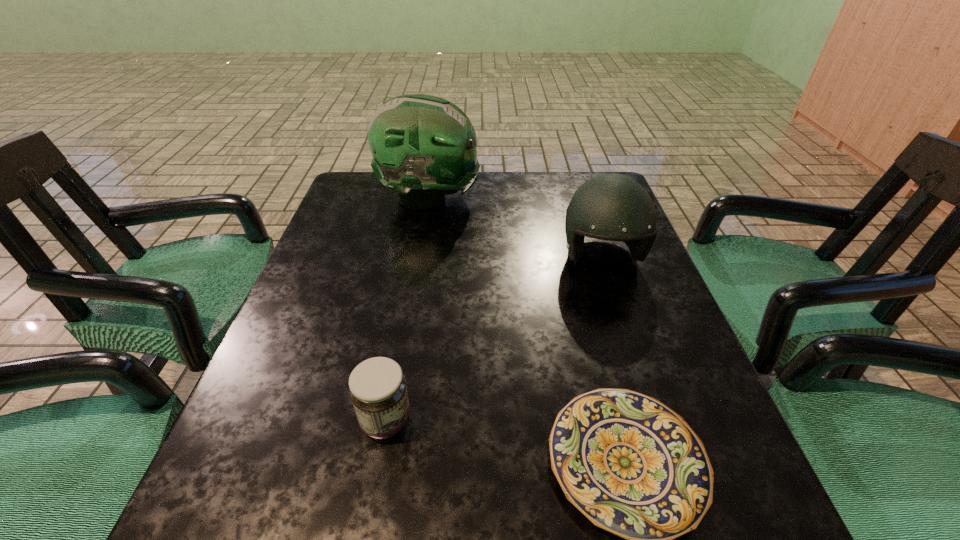
Identify the location of object located at the right edge. This screenshot has height=540, width=960. (614, 207).

You are a GUI agent. You are given a task and a screenshot of the screen. Output one action in this format:
    pyautogui.click(x=<x>, y=<y>)
    Task: Click on the object that is at the far left corner
    
    Given the screenshot: What is the action you would take?
    pyautogui.click(x=423, y=147)

Locate an element on the screen. vacant space at the near edge is located at coordinates (550, 501).

In the image, there is a desktop. In order to click on vacant region at the left edge in this screenshot , I will do `click(322, 236)`.

Locate an element on the screen. The image size is (960, 540). vacant space at the right edge is located at coordinates (585, 242).

Image resolution: width=960 pixels, height=540 pixels. In order to click on empty space between the jam and the third nearest object in this screenshot , I will do `click(493, 340)`.

The width and height of the screenshot is (960, 540). Find the location of `blank region between the taller football helmet and the third tallest object`. blank region between the taller football helmet and the third tallest object is located at coordinates (408, 309).

Locate an element on the screen. The width and height of the screenshot is (960, 540). free space between the shorter football helmet and the tallest object is located at coordinates (516, 228).

Identify the location of free area in between the farthest object and the jam. This screenshot has width=960, height=540. (408, 309).

Find the location of a particular element. Image resolution: width=960 pixels, height=540 pixels. object that can be found as the third closest to the plate is located at coordinates (423, 147).